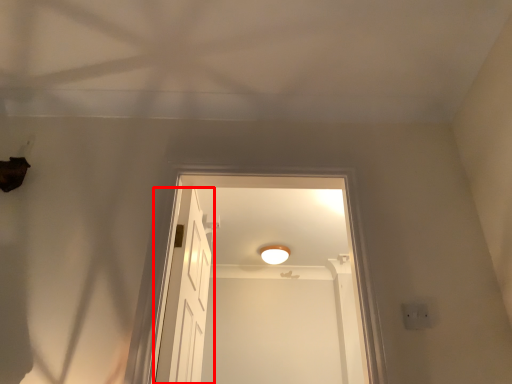
Question: In this image, where is door (annotated by the red box) located relative to light fixture?

Choices:
 (A) left
 (B) right

Answer: (A)